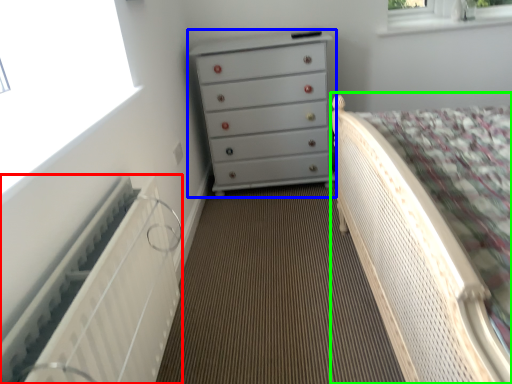
Question: Based on their relative distances, which object is farther from radiator (highlighted by a red box)? Choose from chest of drawers (highlighted by a blue box) and bed (highlighted by a green box).

Choices:
 (A) chest of drawers
 (B) bed

Answer: (A)